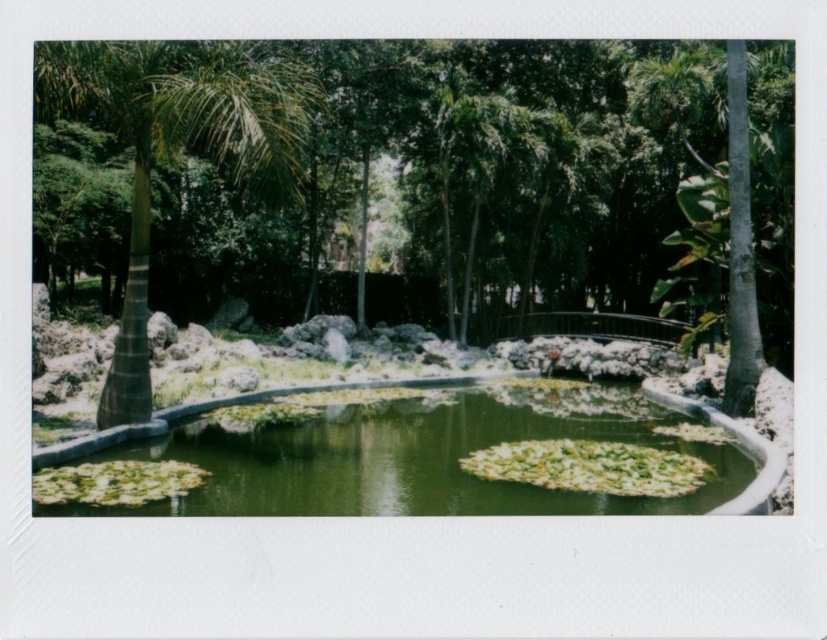
Question: Which of the following is the farthest from the observer?

Choices:
 (A) (257, 420)
 (B) (240, 152)
 (C) (50, 77)

Answer: (A)

Question: Among these objects, which one is farthest from the camera?

Choices:
 (A) green leafy palm tree at left
 (B) green leafy tree at center
 (C) green mossy pond at center

Answer: (A)

Question: Observing the image, what is the correct spatial positioning of green leafy tree at center in reference to green mossy pond at center?

Choices:
 (A) right
 (B) left

Answer: (B)

Question: Which object is positioned closest to the green leafy palm tree at left?

Choices:
 (A) green mossy pond at center
 (B) green leafy tree at center

Answer: (A)

Question: Does green mossy pond at center have a larger size compared to green leafy palm tree at left?

Choices:
 (A) no
 (B) yes

Answer: (B)

Question: Can you confirm if green mossy pond at center is bigger than green leafy palm tree at left?

Choices:
 (A) no
 (B) yes

Answer: (B)